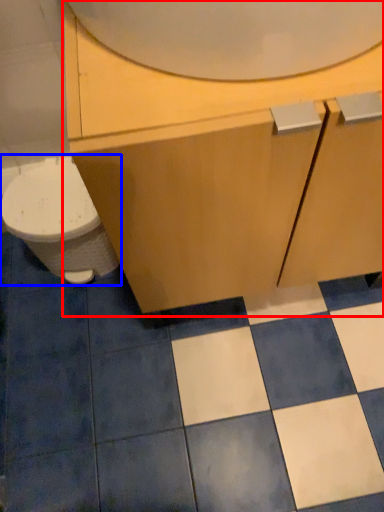
Question: Which of the following is the closest to the observer, bathroom cabinet (highlighted by a red box) or toilet (highlighted by a blue box)?

Choices:
 (A) bathroom cabinet
 (B) toilet

Answer: (A)